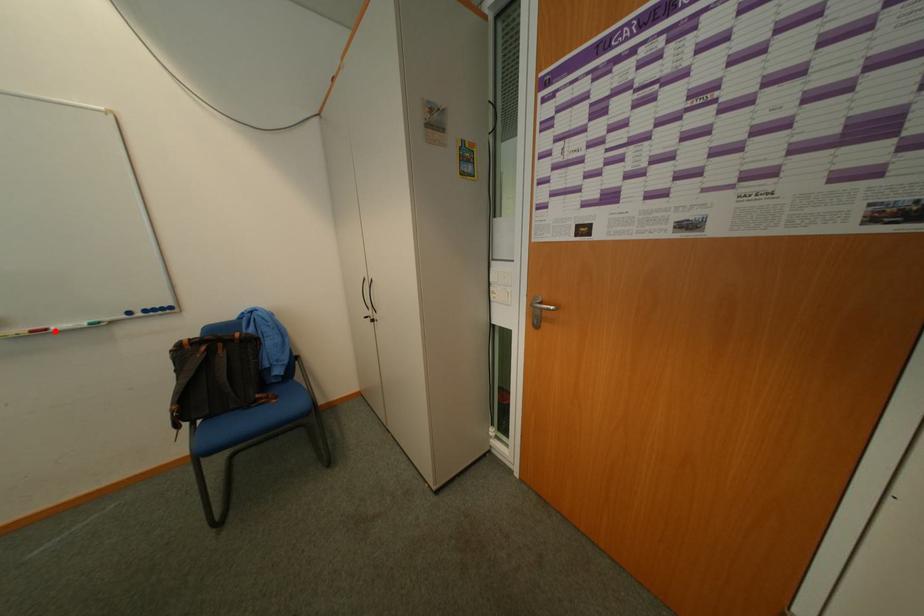
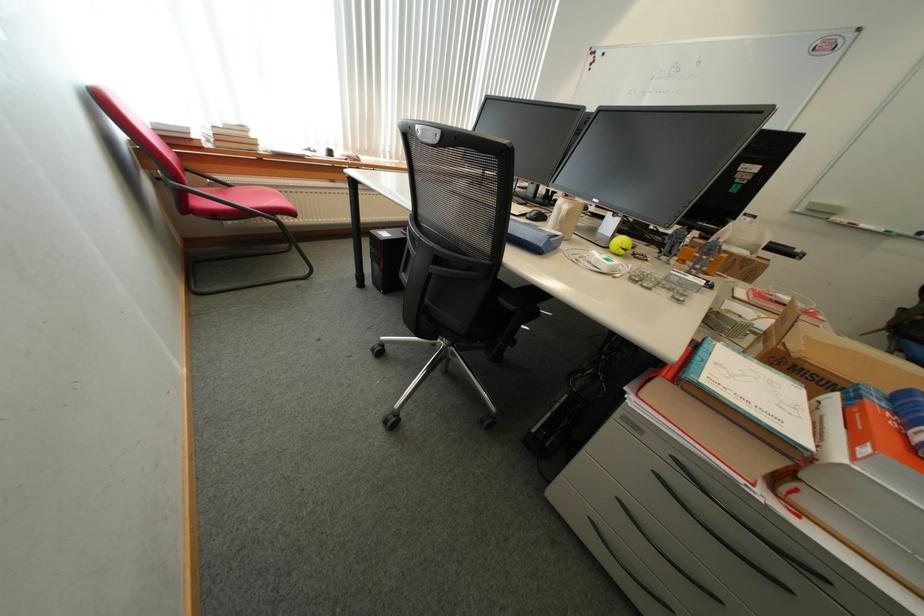
Locate, in the second image, the point that corresponds to the highlighted location in the first image.

(861, 225)